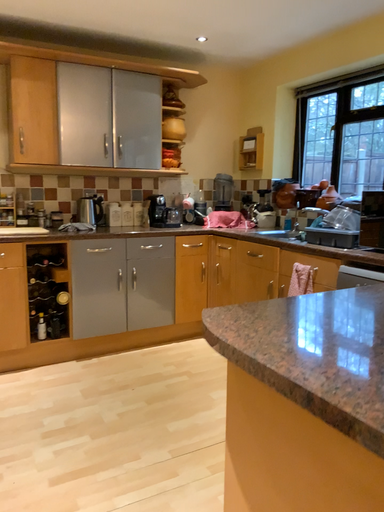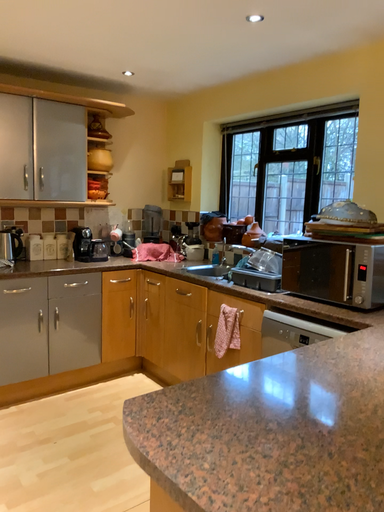
Question: How did the camera likely rotate when shooting the video?

Choices:
 (A) rotated left
 (B) rotated right

Answer: (B)